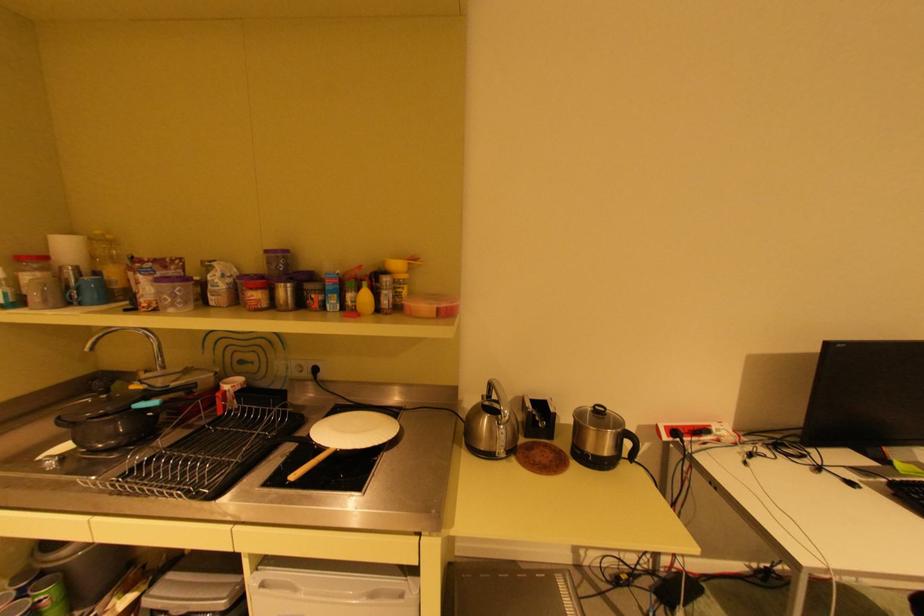
Which object does [84,289] point to?

This point indicates the blue mug.